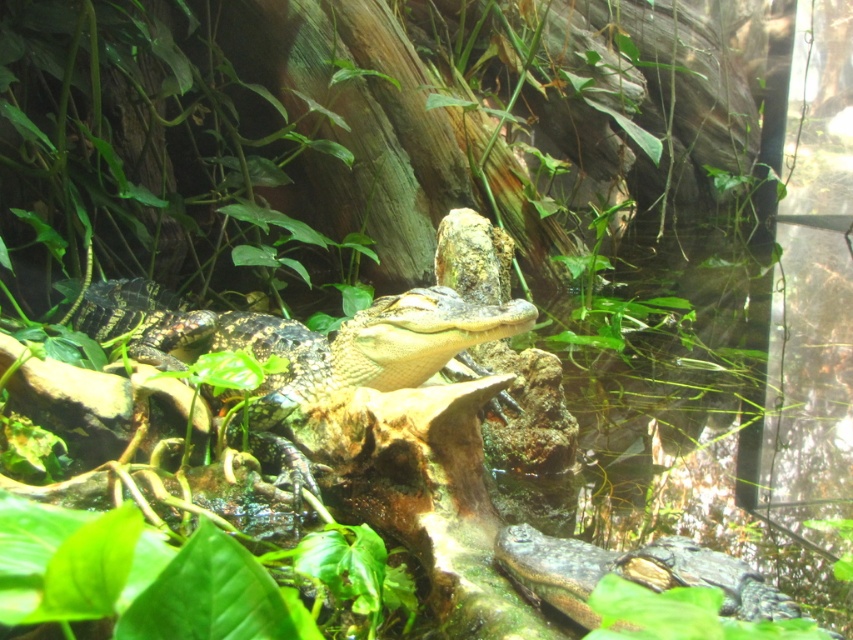
Is shiny green crocodile at center shorter than dark green scaly crocodile at lower right?

No.

The image size is (853, 640). Identify the location of shiny green crocodile at center. [300, 348].

The image size is (853, 640). What are the coordinates of `shiny green crocodile at center` in the screenshot? It's located at (300, 348).